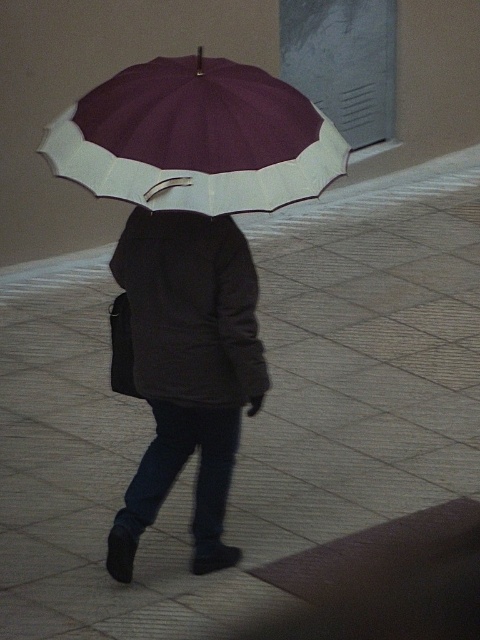
Question: Is dark gray fabric jacket at center smaller than maroon fabric umbrella at upper center?

Choices:
 (A) no
 (B) yes

Answer: (A)

Question: Does dark gray fabric jacket at center appear on the left side of maroon fabric umbrella at upper center?

Choices:
 (A) no
 (B) yes

Answer: (B)

Question: Can you confirm if dark gray fabric jacket at center is positioned to the left of maroon fabric umbrella at upper center?

Choices:
 (A) no
 (B) yes

Answer: (B)

Question: Which object appears closest to the camera in this image?

Choices:
 (A) dark gray fabric jacket at center
 (B) maroon fabric umbrella at upper center

Answer: (B)